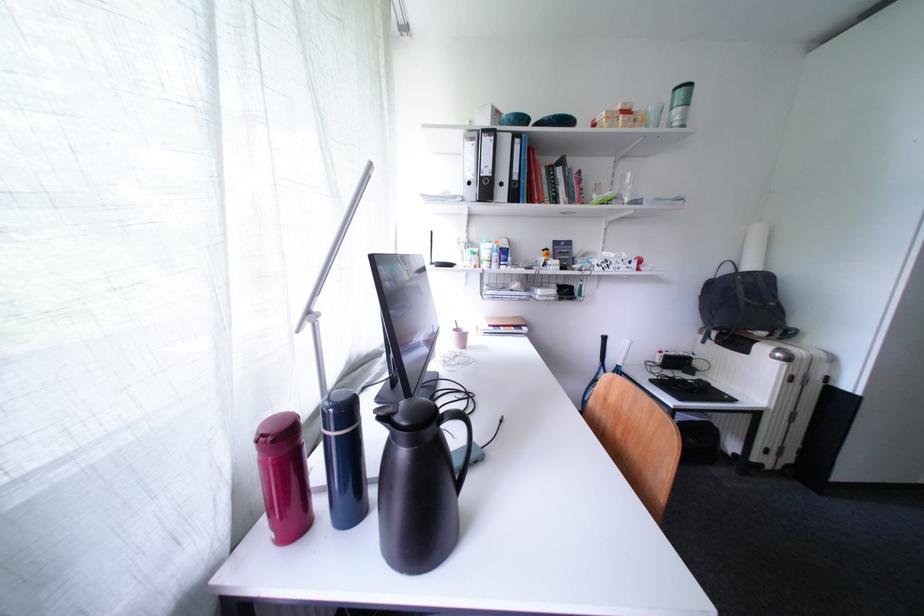
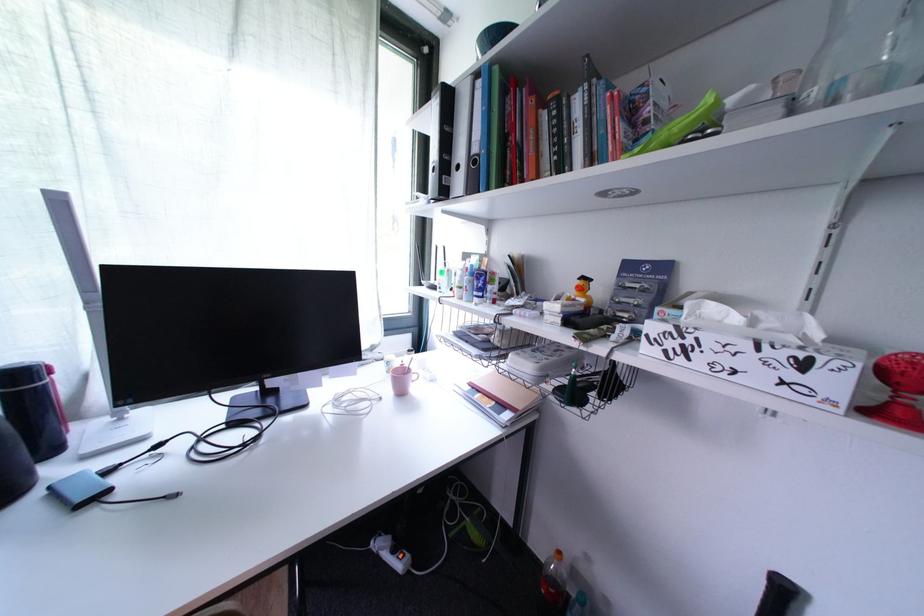
In the second image, find the point that corresponds to the point at 621,257 in the first image.

(745, 321)